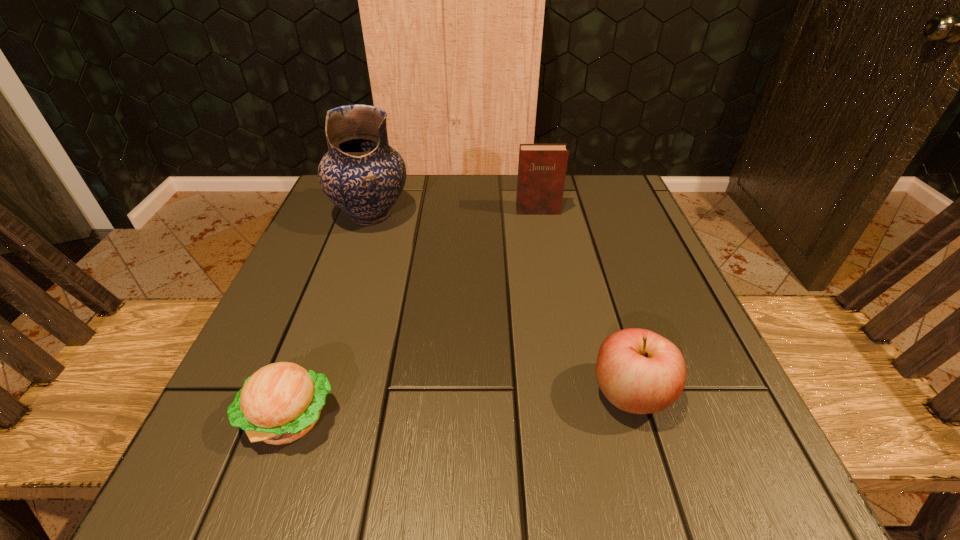
Image resolution: width=960 pixels, height=540 pixels. I want to click on the tallest object, so click(361, 174).

This screenshot has width=960, height=540. In order to click on the second tallest object in this screenshot , I will do `click(542, 168)`.

You are a GUI agent. You are given a task and a screenshot of the screen. Output one action in this format:
    pyautogui.click(x=<x>, y=<y>)
    Task: Click on the apple
    The height and width of the screenshot is (540, 960).
    Given the screenshot: What is the action you would take?
    pyautogui.click(x=639, y=371)

Where is `the shortest object`? The height and width of the screenshot is (540, 960). the shortest object is located at coordinates (281, 402).

Locate an element on the screen. free space located on the front of the tallest object is located at coordinates (344, 293).

The image size is (960, 540). In order to click on free space located on the front cover of the third shortest object in this screenshot , I will do `click(551, 286)`.

Identify the location of free space located 0.050m on the back of the second shortest object. (614, 338).

Locate an element on the screen. This screenshot has height=540, width=960. blank area located on the back of the hamburger is located at coordinates (324, 322).

In order to click on pottery that is at the far edge in this screenshot , I will do `click(361, 174)`.

I want to click on diary positioned at the far edge, so click(542, 168).